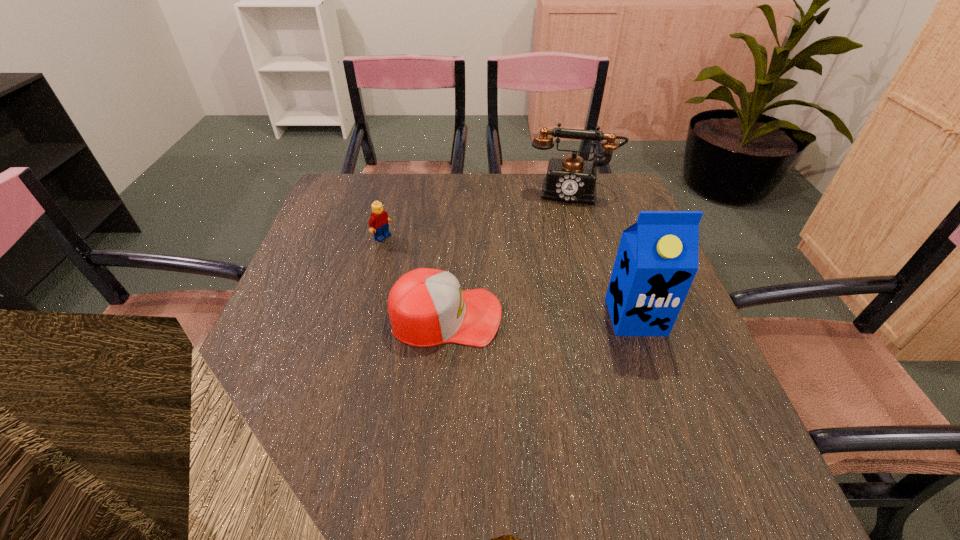
This screenshot has height=540, width=960. What are the coordinates of `free location located on the front of the second tallest object at the rotary dial` in the screenshot? It's located at tap(559, 284).

Locate an element on the screen. This screenshot has width=960, height=540. free spot located on the front-facing side of the third nearest object is located at coordinates (490, 300).

Identify the location of free location located on the front-facing side of the third nearest object. (451, 277).

Find the location of a particular element. The height and width of the screenshot is (540, 960). vacant space located on the front-facing side of the third nearest object is located at coordinates (511, 312).

Locate an element on the screen. This screenshot has width=960, height=540. object present at the far edge is located at coordinates (571, 179).

Where is `carton that is at the right edge`? The image size is (960, 540). carton that is at the right edge is located at coordinates 657,259.

The height and width of the screenshot is (540, 960). I want to click on telephone present at the right edge, so click(x=571, y=179).

The image size is (960, 540). I want to click on object that is at the far right corner, so click(571, 179).

At what (x,y) coordinates should I click in order to perform the action: click on free space at the far edge of the desktop. Please return your answer as a coordinate pair (x, y). This screenshot has width=960, height=540. Looking at the image, I should click on (508, 188).

Find the location of a particular element. Image resolution: width=960 pixels, height=540 pixels. vacant position at the near edge of the desktop is located at coordinates (531, 431).